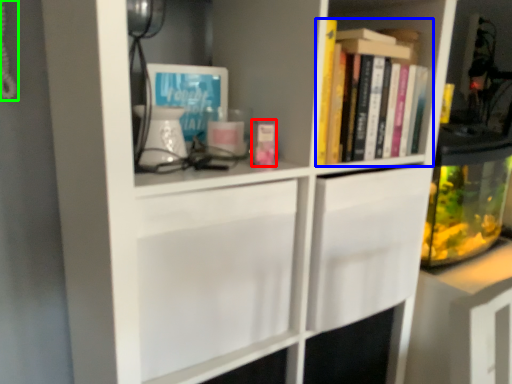
Question: Considering the real-world distances, which object is farthest from book (highlighted by a red box)? book (highlighted by a blue box) or corded phone (highlighted by a green box)?

Choices:
 (A) book
 (B) corded phone

Answer: (B)